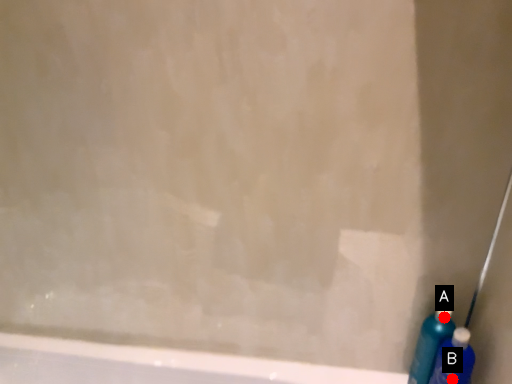
Question: Two points are circled on the image, labeled by A and B beside each circle. Which point is closer to the camera?

Choices:
 (A) A is closer
 (B) B is closer

Answer: (B)